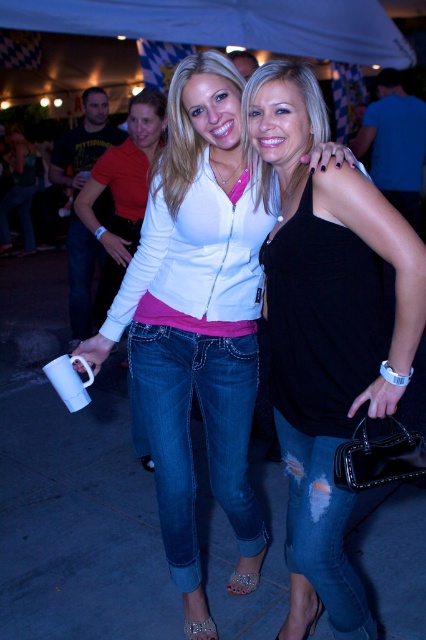
Does ripped denim jeans at lower right have a smaller size compared to white matte shirt at upper center?

Indeed, ripped denim jeans at lower right has a smaller size compared to white matte shirt at upper center.

Which is above, ripped denim jeans at lower right or white matte shirt at upper center?

white matte shirt at upper center is higher up.

Image resolution: width=426 pixels, height=640 pixels. What do you see at coordinates (319, 540) in the screenshot? I see `ripped denim jeans at lower right` at bounding box center [319, 540].

Where is `ripped denim jeans at lower right`? The image size is (426, 640). ripped denim jeans at lower right is located at coordinates (319, 540).

Does point (164, 308) come behind point (143, 189)?

No, (164, 308) is in front of (143, 189).

Who is higher up, jeans at center or white matte shirt at upper center?

white matte shirt at upper center is higher up.

Find the location of a particular element. The height and width of the screenshot is (640, 426). jeans at center is located at coordinates (196, 323).

Which of these two, white fabric canopy at upper center or ripped denim jeans at lower right, stands taller?

white fabric canopy at upper center

Is point (69, 28) behind point (276, 413)?

Yes, it is behind point (276, 413).

The image size is (426, 640). I want to click on white fabric canopy at upper center, so click(229, 24).